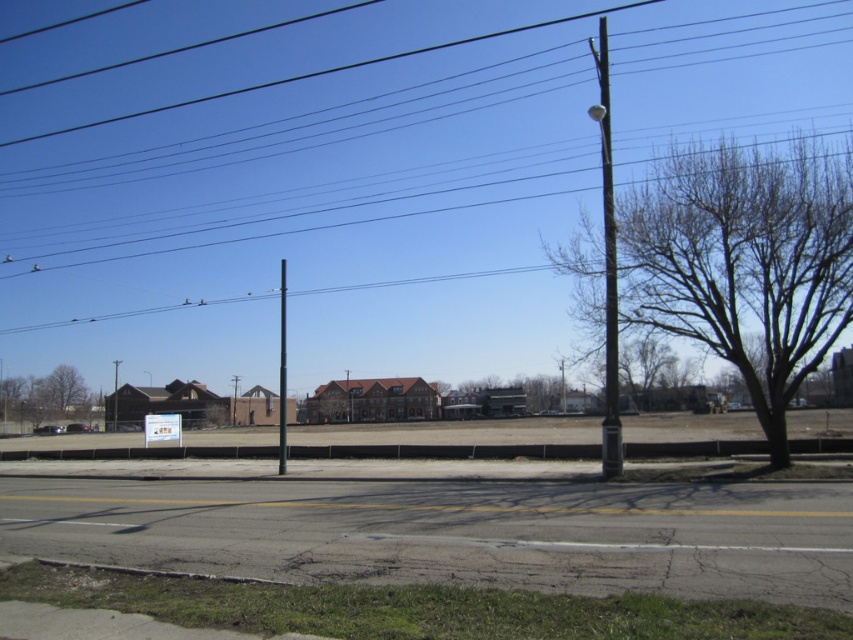
You are a delivery driver approaching the construction site and see the black wire at upper center and the white plastic sign at center. Which object is located to the right of the other?

The black wire at upper center is positioned on the right side of white plastic sign at center.

You are standing at the point marked as point (x=309, y=193) in the image. What object is located exactly at that point?

The black wire at upper center is located exactly at point (x=309, y=193).

You are a city planner assessing the space between the bare wood tree at right and the black metal pole at center. If you want to install a new rectangular sign that is 2 meters wide, will there be enough space between them? Please consider their widths as well as the distance between them.

The bare wood tree at right is wider than the black metal pole at center. However, the question does not provide information about the distance between them, so it is impossible to determine if there is enough space for the 2 meter wide sign. More details about the separation between the two objects are needed.